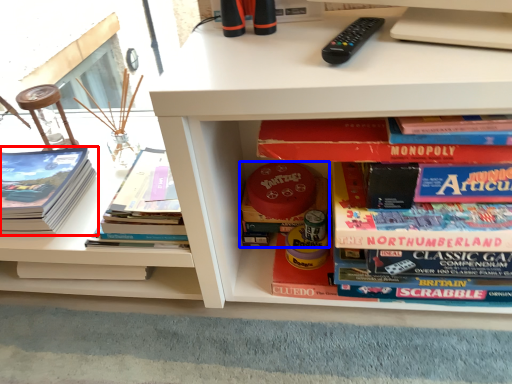
Question: Which object appears closest to the camera in this image, book (highlighted by a red box) or book (highlighted by a blue box)?

Choices:
 (A) book
 (B) book

Answer: (A)